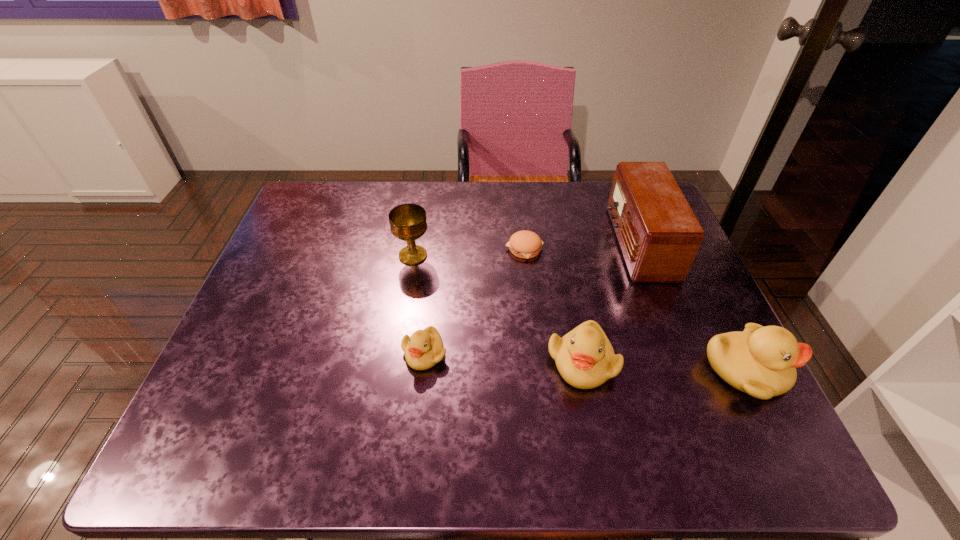
You are a GUI agent. You are given a task and a screenshot of the screen. Output one action in this format:
    pyautogui.click(x=<x>, y=<y>)
    Task: Click on the free spot at the left edge of the desktop
    The height and width of the screenshot is (540, 960).
    Given the screenshot: What is the action you would take?
    pyautogui.click(x=245, y=325)

I want to click on free spot at the right edge of the desktop, so click(674, 320).

This screenshot has height=540, width=960. Find the location of `free region at the far left corner of the desktop`. free region at the far left corner of the desktop is located at coordinates (302, 227).

Where is `free space between the patty and the rightmost duckling`? free space between the patty and the rightmost duckling is located at coordinates (635, 309).

The width and height of the screenshot is (960, 540). I want to click on free point between the patty and the chalice, so click(468, 252).

Image resolution: width=960 pixels, height=540 pixels. What are the coordinates of `vacant point located between the shortest object and the tallest object` in the screenshot? It's located at (581, 245).

Find the location of `empty space between the rightmost duckling and the patty`. empty space between the rightmost duckling and the patty is located at coordinates (635, 309).

Where is `vacant space in between the fourth tallest object and the tallest object`? The width and height of the screenshot is (960, 540). vacant space in between the fourth tallest object and the tallest object is located at coordinates (611, 302).

Find the location of a particular element. This screenshot has height=540, width=960. unoccupied position between the leftmost duckling and the second duckling from left to right is located at coordinates (503, 357).

Where is `free spot between the tallest object and the second duckling from right to left`? The width and height of the screenshot is (960, 540). free spot between the tallest object and the second duckling from right to left is located at coordinates (611, 302).